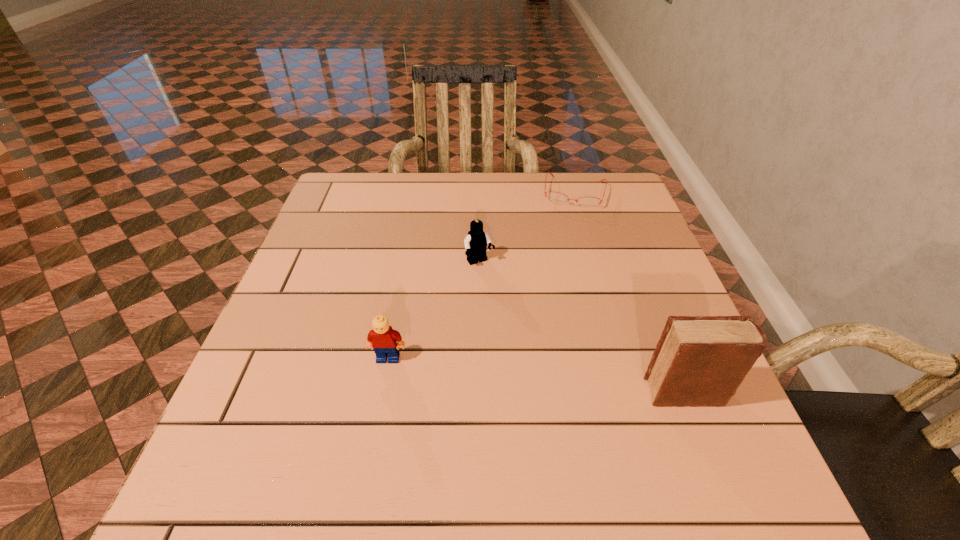
Locate an element on the screen. The width and height of the screenshot is (960, 540). object at the near right corner is located at coordinates (700, 361).

The height and width of the screenshot is (540, 960). In the image, there is a desktop. What are the coordinates of `vacant space at the far edge` in the screenshot? It's located at (419, 204).

Where is `vacant space at the near edge of the desktop`? This screenshot has width=960, height=540. vacant space at the near edge of the desktop is located at coordinates (509, 402).

Image resolution: width=960 pixels, height=540 pixels. In the image, there is a desktop. Find the location of `vacant space at the left edge`. vacant space at the left edge is located at coordinates (304, 294).

In order to click on vacant area at the right edge of the desktop in this screenshot , I will do `click(622, 276)`.

Where is `vacant point at the far left corner`? The height and width of the screenshot is (540, 960). vacant point at the far left corner is located at coordinates (325, 201).

This screenshot has height=540, width=960. In order to click on vacant space at the near left corner of the desktop in this screenshot , I will do `click(243, 417)`.

This screenshot has width=960, height=540. In the image, there is a desktop. What are the coordinates of `vacant space at the far right corner` in the screenshot? It's located at (631, 197).

In the image, there is a desktop. Where is `free space at the near right corner`? Image resolution: width=960 pixels, height=540 pixels. free space at the near right corner is located at coordinates (698, 434).

Identify the location of empty space between the third farthest object and the farthest object. (481, 275).